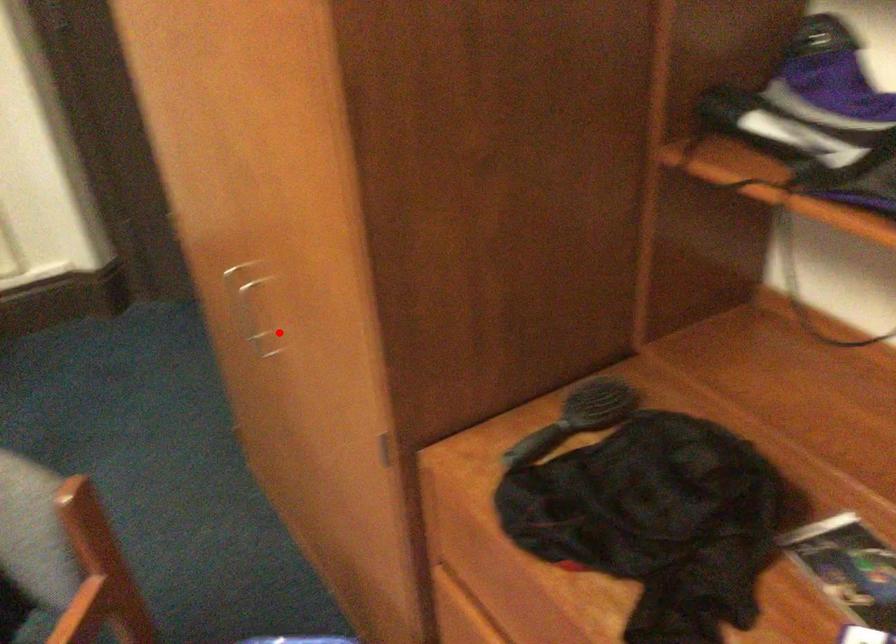
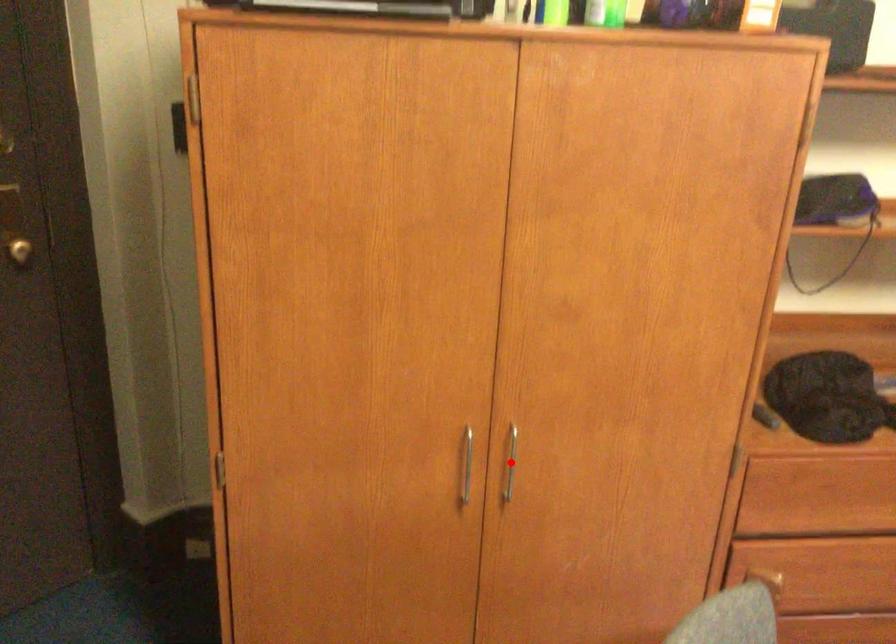
I am providing you with two images of the same scene from different viewpoints. A red point is marked on the first image and another point is marked on the second image. Are the points marked in image1 and image2 representing the same 3D position?

Yes